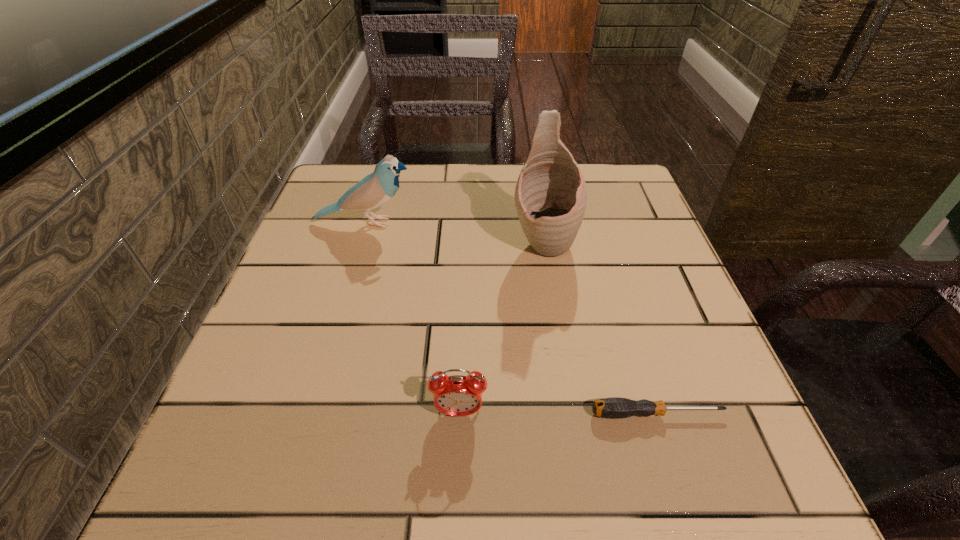
You are a GUI agent. You are given a task and a screenshot of the screen. Output one action in this format:
    pyautogui.click(x=<x>, y=<y>)
    Task: Click on the empty location between the alarm clock and the pitcher
    The width and height of the screenshot is (960, 540).
    Given the screenshot: What is the action you would take?
    pyautogui.click(x=501, y=328)

You are a GUI agent. You are given a task and a screenshot of the screen. Output one action in this format:
    pyautogui.click(x=<x>, y=<y>)
    Task: Click on the object that is the third nearest to the third tallest object
    
    Given the screenshot: What is the action you would take?
    pyautogui.click(x=375, y=189)

Locate an element on the screen. This screenshot has height=540, width=960. object that is the third nearest to the pitcher is located at coordinates (457, 395).

Identify the location of vacant space that satisfies the following two spatial constraints: 1. at the spout of the tallest object; 2. on the right side of the screwdriver. Image resolution: width=960 pixels, height=540 pixels. (571, 414).

Locate an element on the screen. The height and width of the screenshot is (540, 960). vacant space that satisfies the following two spatial constraints: 1. on the face of the screwdriver; 2. on the right side of the alarm clock is located at coordinates (459, 414).

You are a GUI agent. You are given a task and a screenshot of the screen. Output one action in this format:
    pyautogui.click(x=<x>, y=<y>)
    Task: Click on the vacant position in the image that satisfies the following two spatial constraints: 1. on the face of the second shortest object; 2. on the right side of the shortest object
    
    Given the screenshot: What is the action you would take?
    pyautogui.click(x=459, y=414)